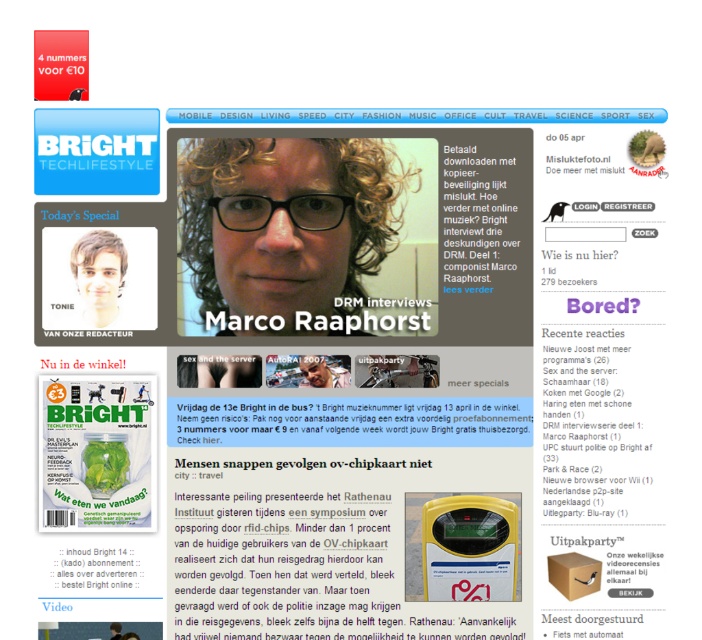
You are a user navigating the Bright website. You see two points on the page. The first point is at coordinates point (256, 204) and the second point is at point (128, 557). Which point is closer to you as you look at the screen?

Point (256, 204) is further to the camera than point (128, 557), so the second point is closer to you.

You are looking at the website of Bright Techlifestyle. You see two elements on the left side of the page, the curly hair at center and the black paper text at center. Which one appears closer to you?

The curly hair at center appears closer to you because it is further to the viewer than the black paper text at center.

You are navigating a website layout for the publication Bright Techlifestyle. You see two points marked on the left side of the page. The first point is at coordinates point (x=98, y=243) and the second is at point (x=314, y=355). Which point is positioned closer to the top of the page?

Point (x=98, y=243) is closer to the viewer than point (x=314, y=355), so it is positioned closer to the top of the page.